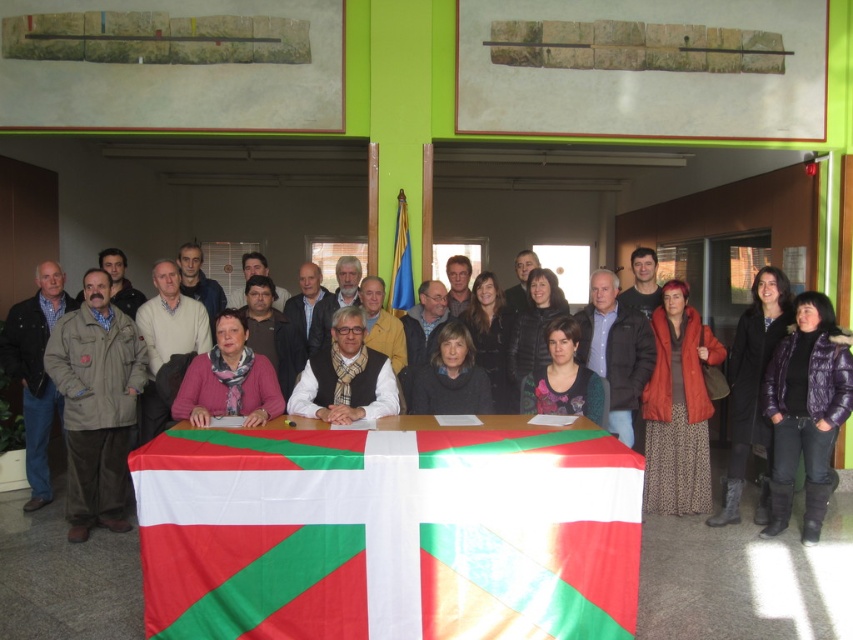
From the picture: You are an event planner arranging seating for a photo. You need to ensure that the leopard print skirt at lower right and the matte gray sweater at center are visible in the photo. Based on their positions, which one is closer to the bottom of the frame?

The leopard print skirt at lower right is located below the matte gray sweater at center, so it is closer to the bottom of the frame.

You are organizing a photo shoot and need to ensure that all clothing items in the scene are appropriately sized for the models. Given the leopard print skirt at lower right and the matte gray sweater at center, which clothing item requires a larger model to fit comfortably?

The leopard print skirt at lower right requires a larger model because it is larger in size than the matte gray sweater at center.